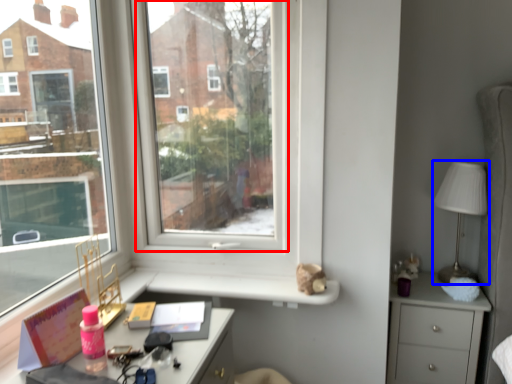
Question: Among these objects, which one is nearest to the camera, window screen (highlighted by a red box) or table lamp (highlighted by a blue box)?

Choices:
 (A) window screen
 (B) table lamp

Answer: (A)